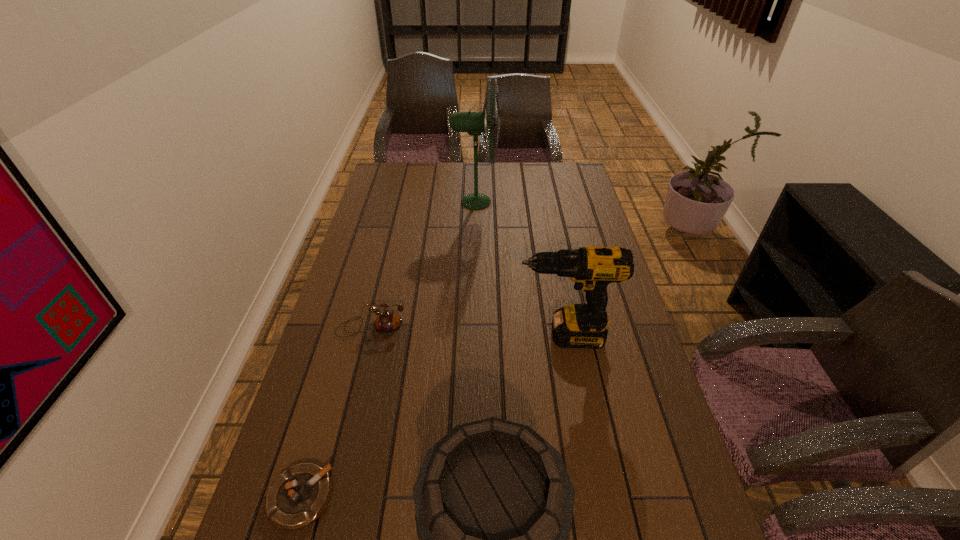
Where is `vacant space that satisfies the following two spatial constraints: 1. on the front-facing side of the fan; 2. on the front side of the ashtray`? vacant space that satisfies the following two spatial constraints: 1. on the front-facing side of the fan; 2. on the front side of the ashtray is located at coordinates coord(471,497).